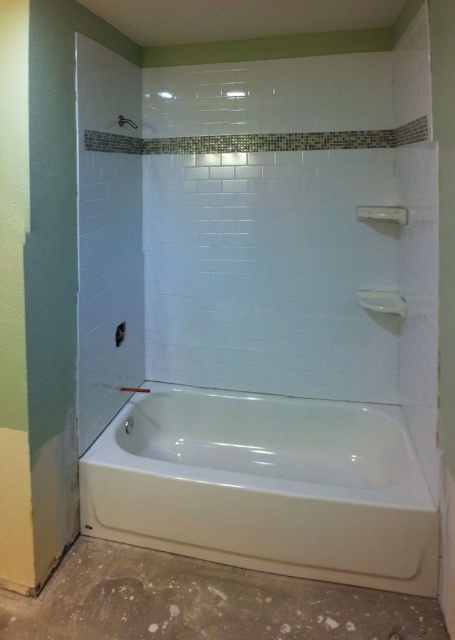
You are designing a bathroom layout and need to place a new towel rack. You see the white glossy bathtub at center and the white glossy shower at upper center. Which object should you place the rack closer to if you want it near the shower but still accessible to the bathtub?

The white glossy bathtub at center is positioned on the right side of the white glossy shower at upper center, so placing the rack near the shower would also make it accessible to the bathtub since they are adjacent.

You are standing in the bathroom and want to place a small decorative item on one of the two points marked in the scene. The first point is at coordinates point [227,403] and the second is at point [117,124]. Which point is further away from you?

Point [227,403] is behind point [117,124], so placing the item on point [227,403] would be further away from you.